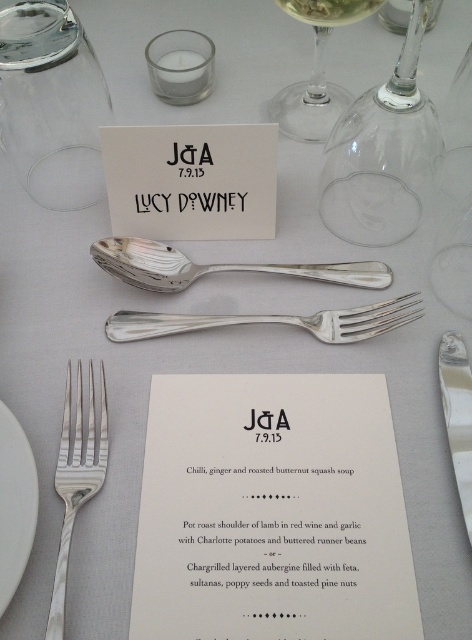
From the picture: You are a guest at the wedding reception and need to place your napkin on the table. The host instructed you to place it to the left of the polished silver fork at upper center. Where should you place it in relation to the white ceramic plate at lower left?

You should place the napkin to the left of the polished silver fork at upper center, which is to the right of the white ceramic plate at lower left. Since the white ceramic plate at lower left is already to the left of the fork, placing the napkin to the fork s left would mean placing it between the plate and the fork.

You are a guest at the wedding reception and want to place a small flower bouquet on the table. The bouquet is 10 centimeters in diameter. You want to place it as close as possible to the point marked at coordinate (336, 154) without overlapping any existing items. Is there enough space? Please consider the distance from the viewer to the point when determining placement.

The point marked at coordinate (336, 154) is 52.62 centimeters from the viewer. Since the bouquet is only 10 centimeters in diameter, there should be sufficient space to place it near the point without overlapping existing items, provided there are no obstructions at that location.

You are a server at a formal event and need to place a napkin in the center of the table. The table has a transparent glass wine glass at upper right. Where should you place the napkin to ensure it doesn not interfere with the glass?

The transparent glass wine glass at upper right is located at point (382, 154). To place the napkin in the center of the table without interfering with the glass, position it away from the upper right corner, ideally at the table center which is typically the midpoint coordinates between all edges.